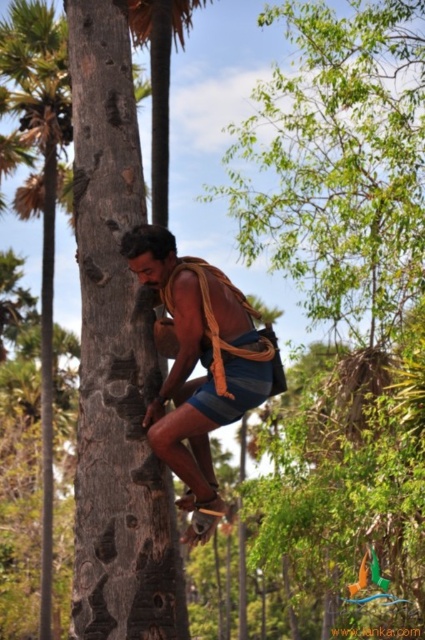
Question: Is smooth brown tree trunk at center below blue striped shorts at center?

Choices:
 (A) yes
 (B) no

Answer: (B)

Question: Which object is the farthest from the smooth brown tree trunk at center?

Choices:
 (A) brown wood palm tree at left
 (B) blue striped shorts at center

Answer: (A)

Question: Is smooth brown tree trunk at center above blue striped shorts at center?

Choices:
 (A) yes
 (B) no

Answer: (A)

Question: Can you confirm if smooth brown tree trunk at center is positioned above blue striped shorts at center?

Choices:
 (A) no
 (B) yes

Answer: (B)

Question: Which point is farther from the camera taking this photo?

Choices:
 (A) (93, 8)
 (B) (167, 269)
 (C) (42, 4)

Answer: (C)

Question: Which point is closer to the camera?

Choices:
 (A) blue striped shorts at center
 (B) smooth brown tree trunk at center

Answer: (B)